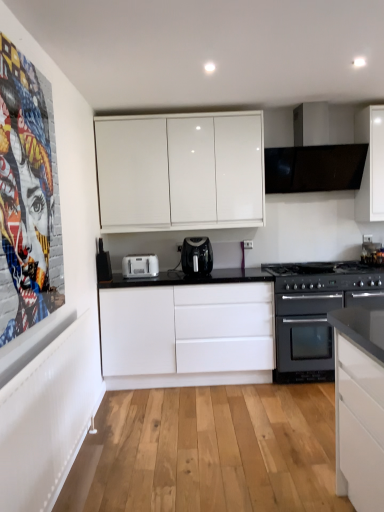
What do you see at coordinates (316, 313) in the screenshot? I see `black matte oven at lower right, placed as the 2th appliance when sorted from left to right` at bounding box center [316, 313].

Identify the location of white matte cabinet at center, the 1th cabinetry ordered from the bottom. (188, 334).

What is the approximate width of colorful collage at left?

It is 1.95 inches.

Identify the location of white plastic toaster at center. The height and width of the screenshot is (512, 384). (140, 266).

In order to click on appliance that is the 1st one below the colorful collage at left (from a real-world perspective) in this screenshot , I will do `click(103, 263)`.

Is black plastic toaster at center, the 2th appliance from the right, to the right of colorful collage at left from the viewer's perspective?

Yes, black plastic toaster at center, the 2th appliance from the right, is to the right of colorful collage at left.

From the image's perspective, does black plastic toaster at center, the 2th appliance from the right, appear lower than colorful collage at left?

Correct, black plastic toaster at center, the 2th appliance from the right, appears lower than colorful collage at left in the image.

Is black plastic toaster at center, the 2th appliance from the right, smaller than colorful collage at left?

Yes, black plastic toaster at center, the 2th appliance from the right, is smaller than colorful collage at left.

Can you tell me how much white glossy cabinet at upper center, marked as the second cabinetry in a bottom-to-top arrangement, and black plastic toaster at center, the first appliance in the top-to-bottom sequence, differ in facing direction?

They differ by 89.8 degrees in their facing directions.

Can you confirm if white glossy cabinet at upper center, marked as the second cabinetry in a bottom-to-top arrangement, is shorter than black plastic toaster at center, the first appliance in the top-to-bottom sequence?

In fact, white glossy cabinet at upper center, marked as the second cabinetry in a bottom-to-top arrangement, may be taller than black plastic toaster at center, the first appliance in the top-to-bottom sequence.

Is point (140, 216) more distant than point (104, 275)?

No, (140, 216) is in front of (104, 275).

Is white glossy cabinet at upper center, which is the first cabinetry from top to bottom, smaller than black plastic toaster at center, which is counted as the second appliance, starting from the bottom?

Actually, white glossy cabinet at upper center, which is the first cabinetry from top to bottom, might be larger than black plastic toaster at center, which is counted as the second appliance, starting from the bottom.

Where is `appliance on the right of black plastic toaster at center, the first appliance from the left`? This screenshot has width=384, height=512. appliance on the right of black plastic toaster at center, the first appliance from the left is located at coordinates (316, 313).

Is black plastic toaster at center, the first appliance in the top-to-bottom sequence, turned away from black matte oven at lower right, placed as the 2th appliance when sorted from left to right?

No, black plastic toaster at center, the first appliance in the top-to-bottom sequence, is not facing the opposite direction of black matte oven at lower right, placed as the 2th appliance when sorted from left to right.

Is point (154, 270) farther from viewer compared to point (159, 328)?

Yes, point (154, 270) is behind point (159, 328).

Choose the correct answer: Is white plastic toaster at center inside white matte cabinet at center, which appears as the 2th cabinetry when viewed from the top, or outside it?

The correct answer is: outside.

Considering the relative sizes of white plastic toaster at center and white matte cabinet at center, the 1th cabinetry ordered from the bottom, in the image provided, is white plastic toaster at center shorter than white matte cabinet at center, the 1th cabinetry ordered from the bottom,?

Yes, white plastic toaster at center is shorter than white matte cabinet at center, the 1th cabinetry ordered from the bottom.

Is white plastic toaster at center aimed at white matte cabinet at center, the 1th cabinetry ordered from the bottom?

No.

Is colorful collage at left with white glossy cabinet at upper center, marked as the second cabinetry in a bottom-to-top arrangement?

colorful collage at left and white glossy cabinet at upper center, marked as the second cabinetry in a bottom-to-top arrangement, are clearly separated.

Does colorful collage at left have a greater height compared to white glossy cabinet at upper center, marked as the second cabinetry in a bottom-to-top arrangement?

Indeed, colorful collage at left has a greater height compared to white glossy cabinet at upper center, marked as the second cabinetry in a bottom-to-top arrangement.

From the image's perspective, is colorful collage at left positioned above or below white glossy cabinet at upper center, marked as the second cabinetry in a bottom-to-top arrangement?

colorful collage at left is below white glossy cabinet at upper center, marked as the second cabinetry in a bottom-to-top arrangement.

Considering the sizes of objects colorful collage at left and white glossy cabinet at upper center, which is the first cabinetry from top to bottom, in the image provided, who is wider, colorful collage at left or white glossy cabinet at upper center, which is the first cabinetry from top to bottom,?

white glossy cabinet at upper center, which is the first cabinetry from top to bottom, is wider.

Would you consider black plastic toaster at center, the first appliance in the top-to-bottom sequence, to be distant from black plastic air fryer at center?

No, black plastic toaster at center, the first appliance in the top-to-bottom sequence, is not far from black plastic air fryer at center.

Measure the distance from black plastic toaster at center, the first appliance in the top-to-bottom sequence, to black plastic air fryer at center.

28.85 inches.

From the picture: Is black plastic toaster at center, the 2th appliance from the right, to the right of black plastic air fryer at center from the viewer's perspective?

In fact, black plastic toaster at center, the 2th appliance from the right, is to the left of black plastic air fryer at center.

From the image's perspective, is black plastic toaster at center, which is counted as the second appliance, starting from the bottom, located above or below black plastic air fryer at center?

Clearly, from the image's perspective, black plastic toaster at center, which is counted as the second appliance, starting from the bottom, is below black plastic air fryer at center.

Which object is further away from the camera, black plastic air fryer at center or white matte cabinet at center, which appears as the 2th cabinetry when viewed from the top?

black plastic air fryer at center.

Considering the sizes of objects black plastic air fryer at center and white matte cabinet at center, which appears as the 2th cabinetry when viewed from the top, in the image provided, who is smaller, black plastic air fryer at center or white matte cabinet at center, which appears as the 2th cabinetry when viewed from the top,?

Smaller between the two is black plastic air fryer at center.

What's the angular difference between black plastic air fryer at center and white matte cabinet at center, which appears as the 2th cabinetry when viewed from the top,'s facing directions?

0.407 degrees.

Is black plastic air fryer at center not within white matte cabinet at center, which appears as the 2th cabinetry when viewed from the top?

Absolutely, black plastic air fryer at center is external to white matte cabinet at center, which appears as the 2th cabinetry when viewed from the top.

The width and height of the screenshot is (384, 512). There is a black plastic toaster at center, which is counted as the second appliance, starting from the bottom. Find the location of `poster page above it (from a real-world perspective)`. poster page above it (from a real-world perspective) is located at coordinates (27, 197).

You are a GUI agent. You are given a task and a screenshot of the screen. Output one action in this format:
    pyautogui.click(x=<x>, y=<y>)
    Task: Click on the appliance that is the 1st object directly below the white glossy cabinet at upper center, which is the first cabinetry from top to bottom (from a real-world perspective)
    This screenshot has height=512, width=384.
    Given the screenshot: What is the action you would take?
    pyautogui.click(x=103, y=263)

Based on their spatial positions, is black plastic toaster at center, which is counted as the second appliance, starting from the bottom, or black matte oven at lower right, the first appliance ordered from the bottom, further from black plastic air fryer at center?

The object further to black plastic air fryer at center is black matte oven at lower right, the first appliance ordered from the bottom.

Based on their spatial positions, is white plastic toaster at center or black matte oven at lower right, the first appliance ordered from the bottom, closer to black plastic toaster at center, which is counted as the second appliance, starting from the bottom?

white plastic toaster at center is closer to black plastic toaster at center, which is counted as the second appliance, starting from the bottom.

Considering their positions, is white plastic toaster at center positioned closer to black plastic air fryer at center than black plastic toaster at center, the first appliance from the left?

white plastic toaster at center is positioned closer to the anchor black plastic air fryer at center.

Which object lies further to the anchor point black plastic toaster at center, the first appliance in the top-to-bottom sequence, white matte cabinet at center, the 1th cabinetry ordered from the bottom, or black plastic air fryer at center?

white matte cabinet at center, the 1th cabinetry ordered from the bottom, lies further to black plastic toaster at center, the first appliance in the top-to-bottom sequence, than the other object.

Looking at the image, which one is located further to white glossy cabinet at upper center, marked as the second cabinetry in a bottom-to-top arrangement, black matte oven at lower right, placed as the 2th appliance when sorted from left to right, or black plastic air fryer at center?

black matte oven at lower right, placed as the 2th appliance when sorted from left to right.

Consider the image. Which object lies further to the anchor point black plastic air fryer at center, black matte oven at lower right, which is the 2th appliance in top-to-bottom order, or white matte cabinet at center, which appears as the 2th cabinetry when viewed from the top?

black matte oven at lower right, which is the 2th appliance in top-to-bottom order, is positioned further to the anchor black plastic air fryer at center.

Which object lies nearer to the anchor point white glossy cabinet at upper center, which is the first cabinetry from top to bottom, colorful collage at left or white plastic toaster at center?

white plastic toaster at center is closer to white glossy cabinet at upper center, which is the first cabinetry from top to bottom.

From the image, which object appears to be nearer to black matte oven at lower right, the first appliance ordered from the bottom, white plastic toaster at center or black matte exhaust hood at upper right?

Among the two, black matte exhaust hood at upper right is located nearer to black matte oven at lower right, the first appliance ordered from the bottom.

Identify the location of toaster that lies between white glossy cabinet at upper center, marked as the second cabinetry in a bottom-to-top arrangement, and black plastic toaster at center, the first appliance in the top-to-bottom sequence, from top to bottom. (140, 266).

You are a GUI agent. You are given a task and a screenshot of the screen. Output one action in this format:
    pyautogui.click(x=<x>, y=<y>)
    Task: Click on the toaster that lies between white glossy cabinet at upper center, marked as the second cabinetry in a bottom-to-top arrangement, and white matte cabinet at center, which appears as the 2th cabinetry when viewed from the top, from top to bottom
    
    Given the screenshot: What is the action you would take?
    coord(140,266)

This screenshot has width=384, height=512. Find the location of `cabinetry between colorful collage at left and black plastic air fryer at center from front to back`. cabinetry between colorful collage at left and black plastic air fryer at center from front to back is located at coordinates (188, 334).

The image size is (384, 512). Identify the location of exhaust hood between white plastic toaster at center and black matte oven at lower right, the first appliance ordered from the bottom, from left to right. (313, 157).